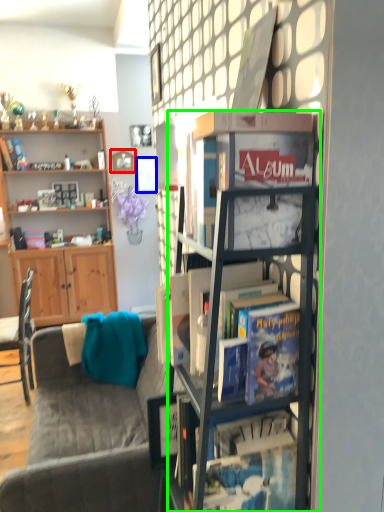
Question: Estimate the real-world distances between objects in this image. Which object is closer to picture frame (highlighted by a red box), picture frame (highlighted by a blue box) or easel (highlighted by a green box)?

Choices:
 (A) picture frame
 (B) easel

Answer: (A)